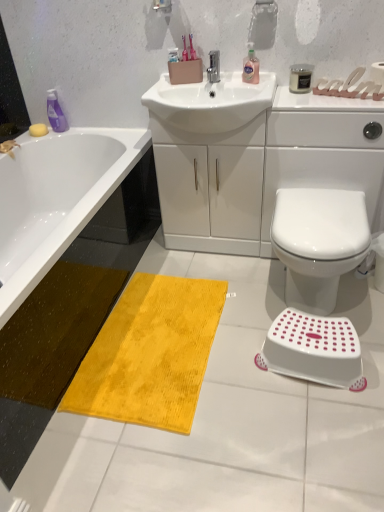
In order to click on free space in front of satin black candle at upper right in this screenshot , I will do `click(313, 104)`.